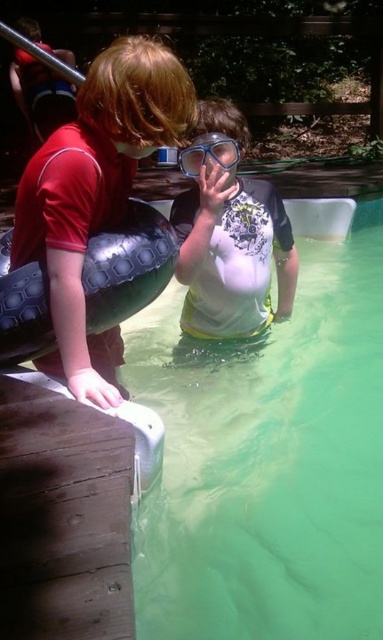
You are a lifeguard who needs to check the water level of the green rubber pool at center. Since the transparent plastic goggles at center are in the way, can you move them to access the pool?

The green rubber pool at center is below the transparent plastic goggles at center, so you can move the transparent plastic goggles at center to access the pool.

You are a lifeguard standing at the edge of the pool. You need to reach the matte red shirt at left to hand them a lifebuoy. Is the distance within your 1.5 meters arm reach?

The matte red shirt at left is 1.41 meters away from the camera, so the lifeguard can reach them with their arm since it is within the 1.5 meters range.